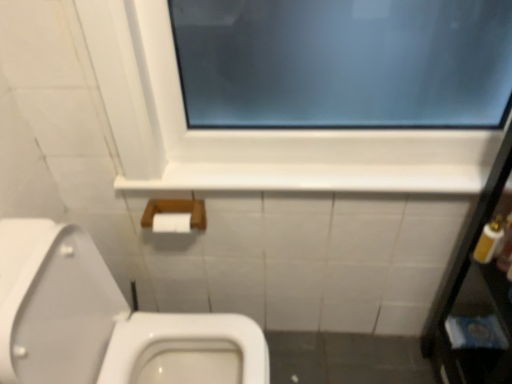
Question: Can you confirm if white plastic bottle at right, acting as the 1th toiletry starting from the right, is wider than white plastic bottle at right, the first toiletry when ordered from left to right?

Choices:
 (A) yes
 (B) no

Answer: (A)

Question: Is white plastic bottle at right, the second toiletry from the left, next to white plastic bottle at right, the first toiletry when ordered from left to right, and touching it?

Choices:
 (A) yes
 (B) no

Answer: (A)

Question: From the image's perspective, would you say white plastic bottle at right, the second toiletry from the left, is positioned over white plastic bottle at right, the first toiletry when ordered from left to right?

Choices:
 (A) no
 (B) yes

Answer: (A)

Question: Is white plastic bottle at right, the second toiletry from the left, outside white plastic bottle at right, arranged as the 2th toiletry when viewed from the right?

Choices:
 (A) no
 (B) yes

Answer: (B)

Question: Would you consider white plastic bottle at right, acting as the 1th toiletry starting from the right, to be distant from white plastic bottle at right, the first toiletry when ordered from left to right?

Choices:
 (A) yes
 (B) no

Answer: (B)

Question: Does white plastic bottle at right, the second toiletry from the left, lie behind white plastic bottle at right, arranged as the 2th toiletry when viewed from the right?

Choices:
 (A) yes
 (B) no

Answer: (B)

Question: Considering the relative sizes of metallic silver mirror at right and wooden box at lower center in the image provided, is metallic silver mirror at right wider than wooden box at lower center?

Choices:
 (A) no
 (B) yes

Answer: (B)

Question: Is metallic silver mirror at right facing away from wooden box at lower center?

Choices:
 (A) yes
 (B) no

Answer: (B)

Question: Is metallic silver mirror at right bigger than wooden box at lower center?

Choices:
 (A) yes
 (B) no

Answer: (A)

Question: Considering the relative sizes of metallic silver mirror at right and wooden box at lower center in the image provided, is metallic silver mirror at right taller than wooden box at lower center?

Choices:
 (A) no
 (B) yes

Answer: (B)

Question: Considering the relative sizes of metallic silver mirror at right and wooden box at lower center in the image provided, is metallic silver mirror at right smaller than wooden box at lower center?

Choices:
 (A) no
 (B) yes

Answer: (A)

Question: Could you tell me if metallic silver mirror at right is turned towards wooden box at lower center?

Choices:
 (A) no
 (B) yes

Answer: (A)

Question: Does white glossy ledge at upper center have a lesser height compared to white plastic bottle at right, the first toiletry when ordered from left to right?

Choices:
 (A) no
 (B) yes

Answer: (B)